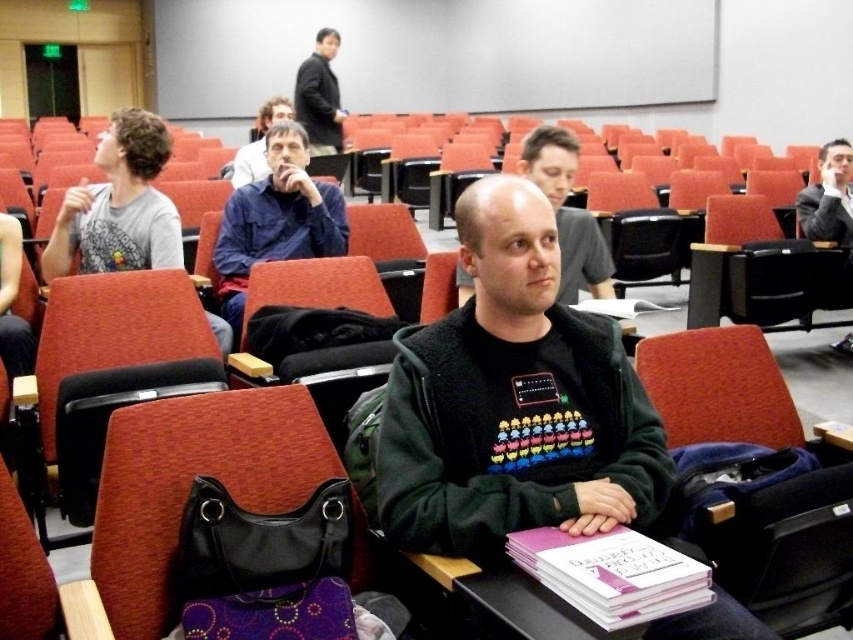
Question: Among these points, which one is farthest from the camera?

Choices:
 (A) [x=786, y=269]
 (B) [x=618, y=330]
 (C) [x=129, y=452]
 (D) [x=564, y=257]

Answer: (A)

Question: Can you confirm if textured fabric chair at center is thinner than dark gray jacket at upper center?

Choices:
 (A) yes
 (B) no

Answer: (B)

Question: Which is nearer to the bald head at center?

Choices:
 (A) blue cotton shirt at center
 (B) black fabric chair at lower left

Answer: (A)

Question: Does black fabric chair at lower left have a lesser width compared to blue cotton shirt at center?

Choices:
 (A) yes
 (B) no

Answer: (A)

Question: Is black fleece jacket at center in front of textured fabric chair at center?

Choices:
 (A) yes
 (B) no

Answer: (A)

Question: Which point appears closest to the camera in this image?

Choices:
 (A) (332, 216)
 (B) (322, 33)

Answer: (A)